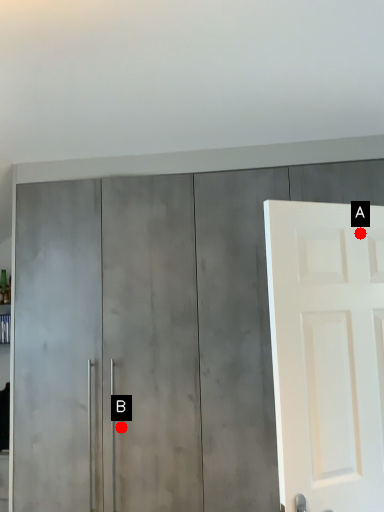
Question: Two points are circled on the image, labeled by A and B beside each circle. Which point appears farthest from the camera in this image?

Choices:
 (A) A is further
 (B) B is further

Answer: (B)